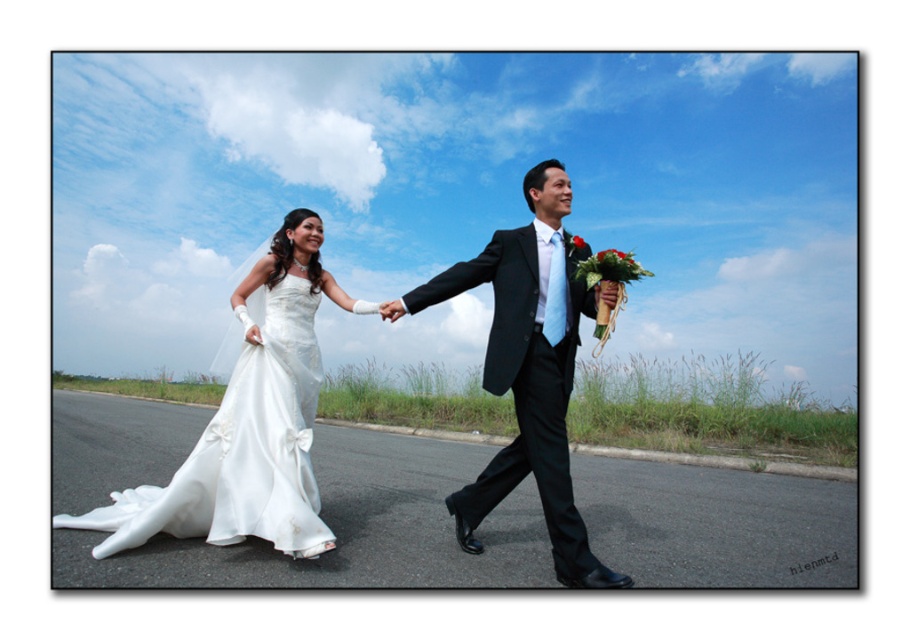
You are a photographer at the wedding. You need to capture a photo where the white satin dress at left and the satin white gown at left are both clearly visible. Which one is positioned higher in the frame?

The white satin dress at left is above the satin white gown at left, so it is positioned higher in the frame.